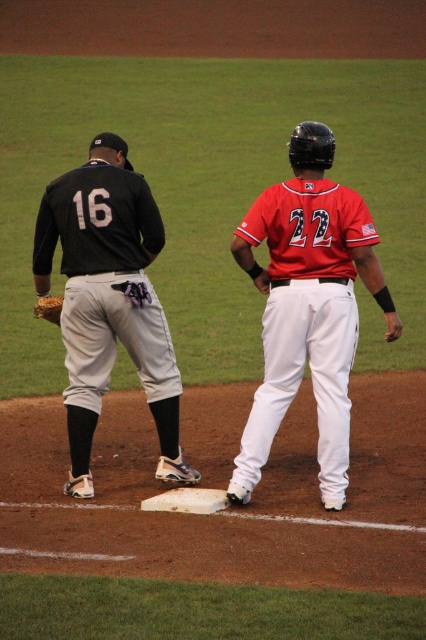
Between red matte jersey at center and brown leather glove at lower left, which one has less height?

With less height is brown leather glove at lower left.

Is red matte jersey at center wider than brown leather glove at lower left?

Yes, red matte jersey at center is wider than brown leather glove at lower left.

At what (x,y) coordinates should I click in order to perform the action: click on red matte jersey at center. Please return your answer as a coordinate pair (x, y). Looking at the image, I should click on (307, 307).

The height and width of the screenshot is (640, 426). What do you see at coordinates (307, 307) in the screenshot?
I see `red matte jersey at center` at bounding box center [307, 307].

Does point (351, 269) come behind point (83, 445)?

That is False.

You are a GUI agent. You are given a task and a screenshot of the screen. Output one action in this format:
    pyautogui.click(x=<x>, y=<y>)
    Task: Click on the red matte jersey at center
    The width and height of the screenshot is (426, 640).
    Given the screenshot: What is the action you would take?
    pyautogui.click(x=307, y=307)

Identify the location of red matte jersey at center. (307, 307).

Can you confirm if matte black jersey at left is taller than brown leather glove at lower left?

Yes, matte black jersey at left is taller than brown leather glove at lower left.

Does matte black jersey at left appear on the right side of brown leather glove at lower left?

Yes, matte black jersey at left is to the right of brown leather glove at lower left.

What do you see at coordinates (109, 300) in the screenshot? The height and width of the screenshot is (640, 426). I see `matte black jersey at left` at bounding box center [109, 300].

Image resolution: width=426 pixels, height=640 pixels. In order to click on matte black jersey at left in this screenshot , I will do `click(109, 300)`.